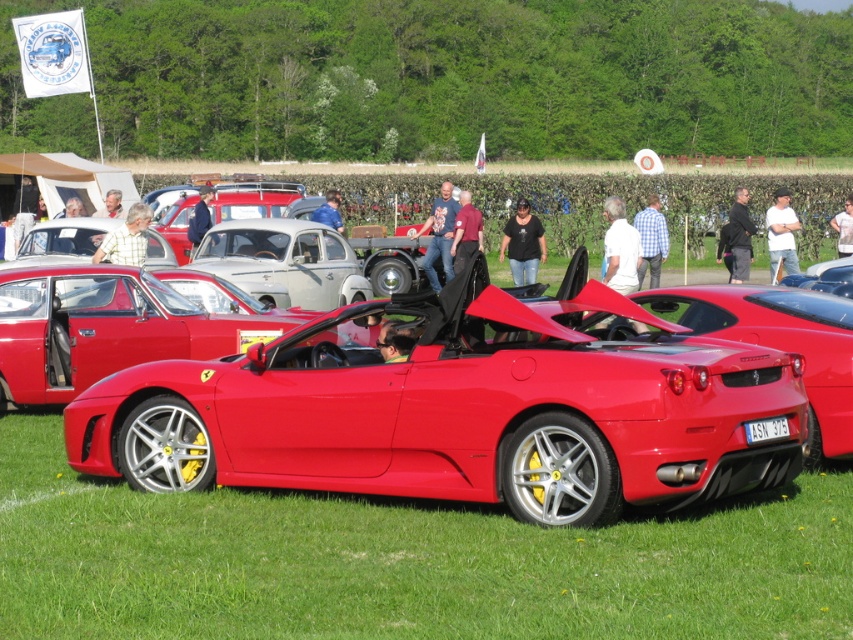
Between shiny red sports car at center and glossy red convertible at center, which one appears on the left side from the viewer's perspective?

glossy red convertible at center

Between point (412, 321) and point (84, 316), which one is positioned behind?

Positioned behind is point (84, 316).

You are a GUI agent. You are given a task and a screenshot of the screen. Output one action in this format:
    pyautogui.click(x=<x>, y=<y>)
    Task: Click on the shiny red sports car at center
    
    Given the screenshot: What is the action you would take?
    pyautogui.click(x=460, y=410)

At what (x,y) coordinates should I click in order to perform the action: click on green grass at lower center. Please return your answer as a coordinate pair (x, y). This screenshot has width=853, height=640. Looking at the image, I should click on (401, 561).

Between green grass at lower center and glossy red convertible at center, which one is positioned higher?

glossy red convertible at center

Identify the location of green grass at lower center. (401, 561).

Does shiny red sports car at center appear over green grass at lower center?

Yes, shiny red sports car at center is above green grass at lower center.

Locate an element on the screen. The image size is (853, 640). shiny red sports car at center is located at coordinates (460, 410).

At what (x,y) coordinates should I click in order to perform the action: click on shiny red sports car at center. Please return your answer as a coordinate pair (x, y). This screenshot has height=640, width=853. Looking at the image, I should click on (460, 410).